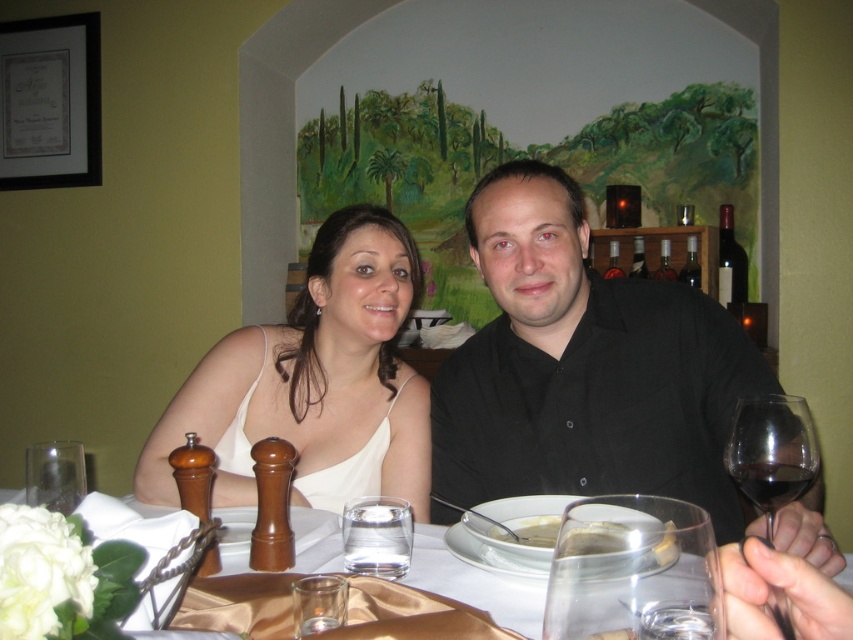
Does translucent glass water at center appear under white creamy soup at center?

Actually, translucent glass water at center is above white creamy soup at center.

Does translucent glass water at center have a lesser height compared to white creamy soup at center?

No.

Identify the location of translucent glass water at center. (474, 582).

Is point (764, 440) farther from camera compared to point (555, 532)?

No, (764, 440) is closer to viewer.

Between point (747, 467) and point (618, 524), which one is positioned behind?

Positioned behind is point (747, 467).

You are a GUI agent. You are given a task and a screenshot of the screen. Output one action in this format:
    pyautogui.click(x=<x>, y=<y>)
    Task: Click on the transparent glass wine glass at right
    The width and height of the screenshot is (853, 640).
    Given the screenshot: What is the action you would take?
    pyautogui.click(x=770, y=452)

Looking at this image, does black matte shirt at center come in front of dark glass bottle at upper right?

Yes, black matte shirt at center is in front of dark glass bottle at upper right.

The image size is (853, 640). I want to click on black matte shirt at center, so click(x=585, y=368).

Locate an element on the screen. The height and width of the screenshot is (640, 853). black matte shirt at center is located at coordinates (585, 368).